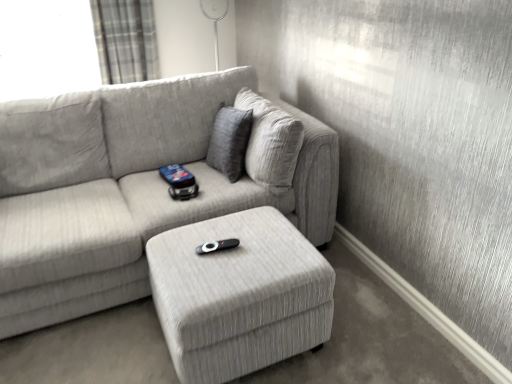
Question: Considering the relative sizes of plaid fabric curtain at upper left and light gray fabric couch at center in the image provided, is plaid fabric curtain at upper left shorter than light gray fabric couch at center?

Choices:
 (A) yes
 (B) no

Answer: (A)

Question: Considering the relative sizes of plaid fabric curtain at upper left and light gray fabric couch at center in the image provided, is plaid fabric curtain at upper left wider than light gray fabric couch at center?

Choices:
 (A) no
 (B) yes

Answer: (A)

Question: Can light gray fabric couch at center be found inside plaid fabric curtain at upper left?

Choices:
 (A) no
 (B) yes

Answer: (A)

Question: Is plaid fabric curtain at upper left looking in the opposite direction of light gray fabric couch at center?

Choices:
 (A) no
 (B) yes

Answer: (A)

Question: From a real-world perspective, is plaid fabric curtain at upper left located higher than light gray fabric couch at center?

Choices:
 (A) yes
 (B) no

Answer: (A)

Question: Is plaid fabric curtain at upper left smaller than light gray fabric couch at center?

Choices:
 (A) yes
 (B) no

Answer: (A)

Question: Considering the relative positions of light gray fabric couch at center and textured gray ottoman at center in the image provided, is light gray fabric couch at center to the right of textured gray ottoman at center from the viewer's perspective?

Choices:
 (A) yes
 (B) no

Answer: (B)

Question: From a real-world perspective, is light gray fabric couch at center on top of textured gray ottoman at center?

Choices:
 (A) no
 (B) yes

Answer: (B)

Question: From the image's perspective, is light gray fabric couch at center on textured gray ottoman at center?

Choices:
 (A) yes
 (B) no

Answer: (A)

Question: From a real-world perspective, is light gray fabric couch at center positioned under textured gray ottoman at center based on gravity?

Choices:
 (A) no
 (B) yes

Answer: (A)

Question: Is light gray fabric couch at center not near textured gray ottoman at center?

Choices:
 (A) no
 (B) yes

Answer: (A)

Question: Does light gray fabric couch at center have a lesser height compared to textured gray ottoman at center?

Choices:
 (A) no
 (B) yes

Answer: (A)

Question: From a real-world perspective, is light gray fabric couch at center on top of plaid fabric curtain at upper left?

Choices:
 (A) yes
 (B) no

Answer: (B)